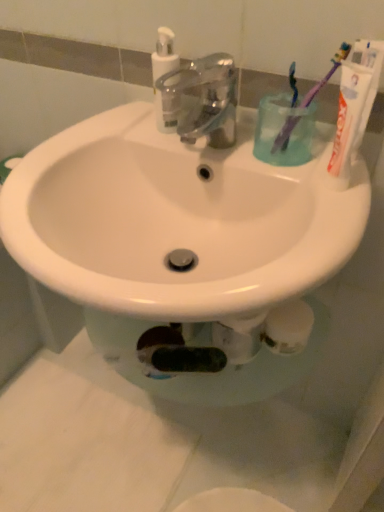
Question: Is metallic faucet at center at the left side of translucent plastic cup at upper right?

Choices:
 (A) no
 (B) yes

Answer: (B)

Question: Is metallic faucet at center oriented towards translucent plastic cup at upper right?

Choices:
 (A) no
 (B) yes

Answer: (A)

Question: Does metallic faucet at center have a greater width compared to translucent plastic cup at upper right?

Choices:
 (A) yes
 (B) no

Answer: (A)

Question: From the image's perspective, is metallic faucet at center located beneath translucent plastic cup at upper right?

Choices:
 (A) no
 (B) yes

Answer: (A)

Question: Is metallic faucet at center bigger than translucent plastic cup at upper right?

Choices:
 (A) yes
 (B) no

Answer: (A)

Question: In terms of height, does purple plastic toothbrush at upper right, which is the first toothbrush from right to left, look taller or shorter compared to translucent plastic cup at upper right?

Choices:
 (A) short
 (B) tall

Answer: (B)

Question: Based on their sizes in the image, would you say purple plastic toothbrush at upper right, acting as the 2th toothbrush starting from the left, is bigger or smaller than translucent plastic cup at upper right?

Choices:
 (A) big
 (B) small

Answer: (B)

Question: From a real-world perspective, is purple plastic toothbrush at upper right, acting as the 2th toothbrush starting from the left, positioned above or below translucent plastic cup at upper right?

Choices:
 (A) above
 (B) below

Answer: (A)

Question: From the image's perspective, is purple plastic toothbrush at upper right, acting as the 2th toothbrush starting from the left, located above or below translucent plastic cup at upper right?

Choices:
 (A) above
 (B) below

Answer: (A)

Question: Relative to metallic faucet at center, is white matte toothpaste at upper right in front or behind?

Choices:
 (A) behind
 (B) front

Answer: (B)

Question: From a real-world perspective, is white matte toothpaste at upper right positioned above or below metallic faucet at center?

Choices:
 (A) above
 (B) below

Answer: (A)

Question: Is white matte toothpaste at upper right wider or thinner than metallic faucet at center?

Choices:
 (A) wide
 (B) thin

Answer: (B)

Question: From the image's perspective, is white matte toothpaste at upper right above or below metallic faucet at center?

Choices:
 (A) above
 (B) below

Answer: (B)

Question: Based on their sizes in the image, would you say white glossy sink at center is bigger or smaller than translucent plastic cup at upper right?

Choices:
 (A) small
 (B) big

Answer: (B)

Question: Visually, is white glossy sink at center positioned to the left or to the right of translucent plastic cup at upper right?

Choices:
 (A) left
 (B) right

Answer: (A)